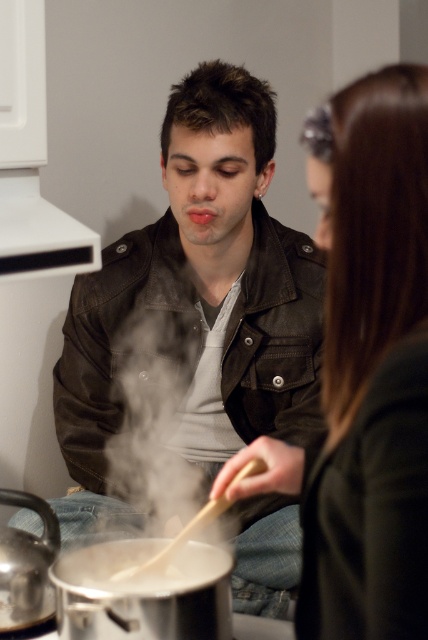
Question: Which point is closer to the camera taking this photo?

Choices:
 (A) (95, 435)
 (B) (80, 554)
 (C) (425, 150)

Answer: (C)

Question: Can you confirm if matte black jacket at center is positioned to the right of smooth brown hair at upper right?

Choices:
 (A) no
 (B) yes

Answer: (A)

Question: Which object is positioned farthest from the white matte pot at lower center?

Choices:
 (A) smooth brown hair at upper right
 (B) matte black jacket at center

Answer: (B)

Question: Is matte black jacket at center positioned at the back of smooth brown hair at upper right?

Choices:
 (A) no
 (B) yes

Answer: (B)

Question: Considering the real-world distances, which object is closest to the matte black jacket at center?

Choices:
 (A) smooth brown hair at upper right
 (B) white matte pot at lower center

Answer: (B)

Question: Is matte black jacket at center wider than smooth brown hair at upper right?

Choices:
 (A) no
 (B) yes

Answer: (B)